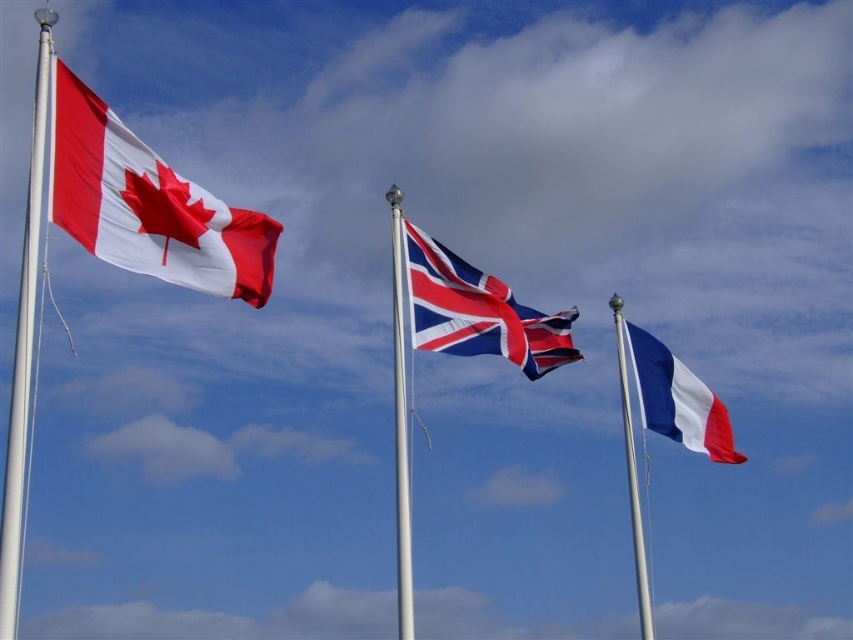
Does white metallic pole at left appear under metallic silver flag pole at center?

No, white metallic pole at left is not below metallic silver flag pole at center.

Is white metallic pole at left to the left of metallic silver flag pole at center from the viewer's perspective?

Indeed, white metallic pole at left is positioned on the left side of metallic silver flag pole at center.

Which is behind, point (44, 17) or point (397, 432)?

Positioned behind is point (397, 432).

The image size is (853, 640). What are the coordinates of `white metallic pole at left` in the screenshot? It's located at (22, 346).

Is matte fabric maple leaf flag at upper left taller than blue fabric flag pole at right?

No.

Is point (76, 209) positioned after point (622, 342)?

No, it is in front of (622, 342).

Does point (73, 113) come in front of point (636, 568)?

Yes, it is.

Where is `matte fabric maple leaf flag at upper left`? Image resolution: width=853 pixels, height=640 pixels. matte fabric maple leaf flag at upper left is located at coordinates [x=148, y=205].

Does metallic silver flag pole at center have a greater height compared to blue fabric flag pole at right?

No.

At what (x,y) coordinates should I click in order to perform the action: click on metallic silver flag pole at center. Please return your answer as a coordinate pair (x, y). This screenshot has width=853, height=640. Looking at the image, I should click on click(x=399, y=428).

Does point (399, 561) come behind point (628, 433)?

No, it is not.

Locate an element on the screen. The image size is (853, 640). metallic silver flag pole at center is located at coordinates (x=399, y=428).